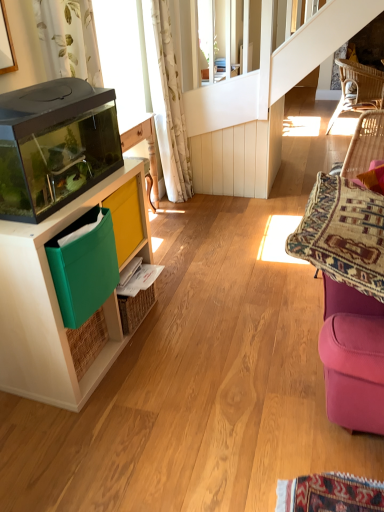
Question: Is matte wood cabinet at left placed right next to transparent glass aquarium at left?

Choices:
 (A) yes
 (B) no

Answer: (B)

Question: From the image's perspective, is matte wood cabinet at left on transparent glass aquarium at left?

Choices:
 (A) no
 (B) yes

Answer: (A)

Question: Considering the relative sizes of matte wood cabinet at left and transparent glass aquarium at left in the image provided, is matte wood cabinet at left wider than transparent glass aquarium at left?

Choices:
 (A) no
 (B) yes

Answer: (B)

Question: From a real-world perspective, is matte wood cabinet at left under transparent glass aquarium at left?

Choices:
 (A) yes
 (B) no

Answer: (A)

Question: Can you confirm if matte wood cabinet at left is thinner than transparent glass aquarium at left?

Choices:
 (A) yes
 (B) no

Answer: (B)

Question: Can transparent glass aquarium at left be found inside matte wood cabinet at left?

Choices:
 (A) no
 (B) yes

Answer: (A)

Question: From a real-world perspective, does woven rattan chair at upper right sit lower than velvet purple swivel chair at right?

Choices:
 (A) no
 (B) yes

Answer: (B)

Question: Considering the relative sizes of woven rattan chair at upper right and velvet purple swivel chair at right in the image provided, is woven rattan chair at upper right wider than velvet purple swivel chair at right?

Choices:
 (A) no
 (B) yes

Answer: (B)

Question: From the image's perspective, does woven rattan chair at upper right appear higher than velvet purple swivel chair at right?

Choices:
 (A) no
 (B) yes

Answer: (B)

Question: Could velvet purple swivel chair at right be considered to be inside woven rattan chair at upper right?

Choices:
 (A) yes
 (B) no

Answer: (B)

Question: Considering the relative sizes of woven rattan chair at upper right and velvet purple swivel chair at right in the image provided, is woven rattan chair at upper right thinner than velvet purple swivel chair at right?

Choices:
 (A) yes
 (B) no

Answer: (B)

Question: Can you confirm if woven rattan chair at upper right is positioned to the left of velvet purple swivel chair at right?

Choices:
 (A) no
 (B) yes

Answer: (A)

Question: Does matte wood cabinet at left come in front of white floral fabric curtain at upper left?

Choices:
 (A) yes
 (B) no

Answer: (A)